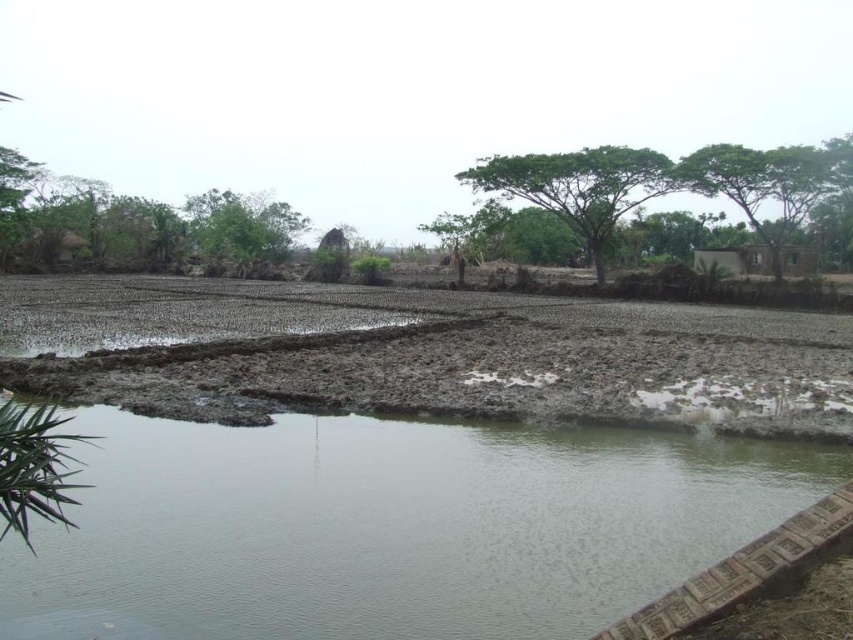
Question: Which is farther from the green leafy tree at upper right?

Choices:
 (A) brown muddy field at center
 (B) clear water at bottom

Answer: (B)

Question: Estimate the real-world distances between objects in this image. Which object is farther from the green leafy tree at upper right?

Choices:
 (A) green leafy tree at center
 (B) clear water at bottom
 (C) brown muddy field at center

Answer: (B)

Question: Does brown muddy field at center have a lesser width compared to green leafy tree at center?

Choices:
 (A) yes
 (B) no

Answer: (B)

Question: Is brown muddy field at center positioned at the back of green leafy tree at center?

Choices:
 (A) no
 (B) yes

Answer: (A)

Question: Which point is closer to the camera?

Choices:
 (A) (138, 403)
 (B) (786, 237)

Answer: (A)

Question: Does brown muddy field at center have a larger size compared to green leafy tree at center?

Choices:
 (A) no
 (B) yes

Answer: (A)